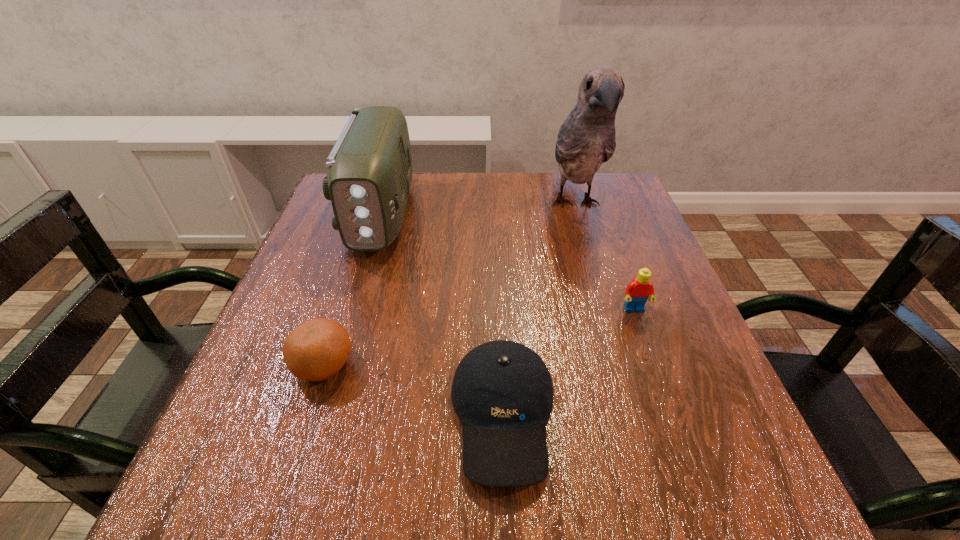
Locate an element on the screen. free space between the clementine and the baseball cap is located at coordinates (414, 390).

This screenshot has height=540, width=960. I want to click on empty space that is in between the third farthest object and the third object from left to right, so click(568, 362).

Where is `free space between the Lego and the third object from right to left`? The width and height of the screenshot is (960, 540). free space between the Lego and the third object from right to left is located at coordinates (568, 362).

Select which object is the fourth closest to the clementine. Please provide its 2D coordinates. Your answer should be formatted as a tuple, i.e. [(x, y)], where the tuple contains the x and y coordinates of a point satisfying the conditions above.

[(586, 139)]

Where is `the second closest object relative to the clementine`? The width and height of the screenshot is (960, 540). the second closest object relative to the clementine is located at coordinates (369, 175).